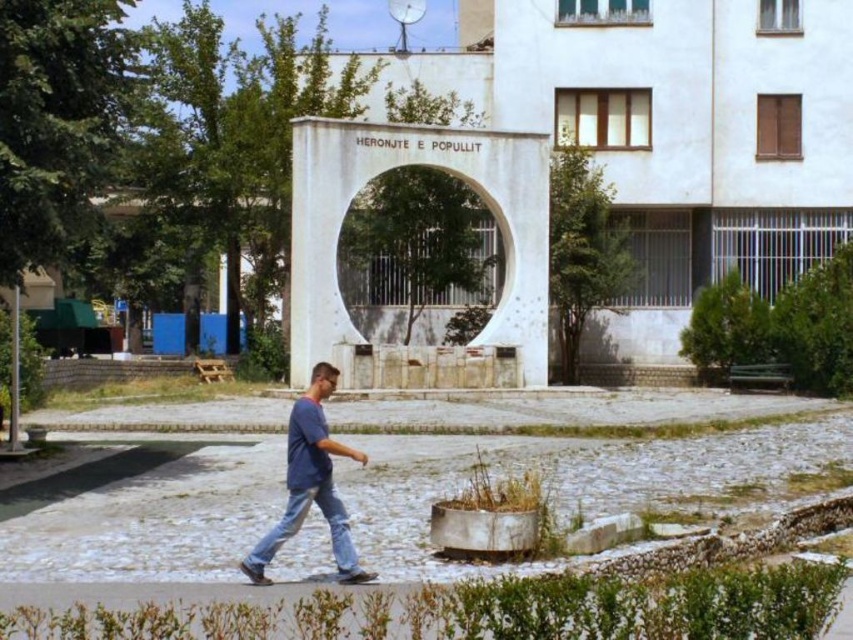
Question: Among these points, which one is nearest to the camera?

Choices:
 (A) (456, 252)
 (B) (358, 564)

Answer: (B)

Question: Among these points, which one is nearest to the camera?

Choices:
 (A) (338, 502)
 (B) (335, 534)
 (C) (409, 202)

Answer: (B)

Question: In this image, where is white concrete archway at center located relative to denim at center?

Choices:
 (A) left
 (B) right

Answer: (B)

Question: Which of these objects is positioned farthest from the blue denim jeans at lower center?

Choices:
 (A) denim at center
 (B) white concrete archway at center

Answer: (B)

Question: Is blue denim jeans at lower center to the left of denim at center from the viewer's perspective?

Choices:
 (A) no
 (B) yes

Answer: (B)

Question: Does blue denim jeans at lower center have a lesser width compared to denim at center?

Choices:
 (A) no
 (B) yes

Answer: (A)